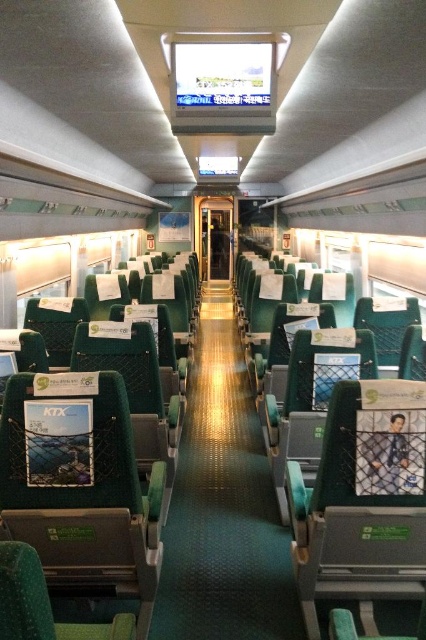
Can you confirm if green fabric aisle at center is positioned to the right of green fabric coach at center?

No, green fabric aisle at center is not to the right of green fabric coach at center.

The width and height of the screenshot is (426, 640). Describe the element at coordinates (224, 506) in the screenshot. I see `green fabric aisle at center` at that location.

At what (x,y) coordinates should I click in order to perform the action: click on green fabric aisle at center. Please return your answer as a coordinate pair (x, y). This screenshot has width=426, height=640. Looking at the image, I should click on (224, 506).